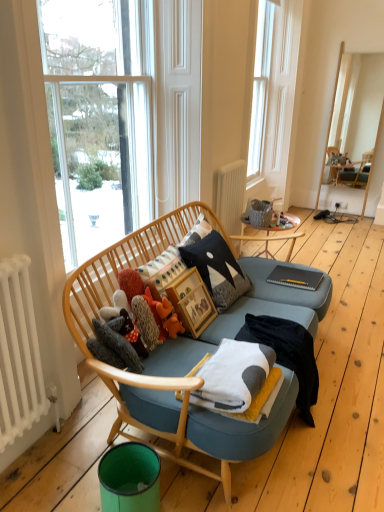
Question: Which direction should I rotate to look at white soft blanket at center, which is the first blanket from back to front?

Choices:
 (A) right
 (B) left

Answer: (A)

Question: Is fuzzy fabric stuffed animal at center, the 2th toy viewed from the right, not within white soft blanket at center, which is the second blanket from back to front?

Choices:
 (A) yes
 (B) no

Answer: (A)

Question: From a real-world perspective, is fuzzy fabric stuffed animal at center, the 2th toy viewed from the right, positioned under white soft blanket at center, which is the second blanket from back to front, based on gravity?

Choices:
 (A) no
 (B) yes

Answer: (A)

Question: Could white soft blanket at center, arranged as the 1th blanket when viewed from the front, be considered to be inside fuzzy fabric stuffed animal at center, which ranks as the first toy in left-to-right order?

Choices:
 (A) yes
 (B) no

Answer: (B)

Question: Considering the relative positions of fuzzy fabric stuffed animal at center, the 2th toy viewed from the right, and white soft blanket at center, which is the second blanket from back to front, in the image provided, is fuzzy fabric stuffed animal at center, the 2th toy viewed from the right, behind white soft blanket at center, which is the second blanket from back to front,?

Choices:
 (A) no
 (B) yes

Answer: (B)

Question: Is fuzzy fabric stuffed animal at center, the 2th toy viewed from the right, with white soft blanket at center, arranged as the 1th blanket when viewed from the front?

Choices:
 (A) yes
 (B) no

Answer: (B)

Question: Does fuzzy fabric stuffed animal at center, which ranks as the first toy in left-to-right order, appear on the right side of white soft blanket at center, which is the second blanket from back to front?

Choices:
 (A) no
 (B) yes

Answer: (A)

Question: Is transparent glass window at upper center looking in the opposite direction of green matte trash can at lower left?

Choices:
 (A) yes
 (B) no

Answer: (B)

Question: From the image's perspective, is transparent glass window at upper center above green matte trash can at lower left?

Choices:
 (A) yes
 (B) no

Answer: (A)

Question: Is transparent glass window at upper center shorter than green matte trash can at lower left?

Choices:
 (A) yes
 (B) no

Answer: (B)

Question: Is transparent glass window at upper center positioned behind green matte trash can at lower left?

Choices:
 (A) no
 (B) yes

Answer: (B)

Question: Is transparent glass window at upper center outside green matte trash can at lower left?

Choices:
 (A) no
 (B) yes

Answer: (B)

Question: Are transparent glass window at upper center and green matte trash can at lower left far apart?

Choices:
 (A) yes
 (B) no

Answer: (A)

Question: Does white radiator at lower left, which is the first radiator in bottom-to-top order, contain white soft blanket at center, arranged as the 1th blanket when viewed from the front?

Choices:
 (A) yes
 (B) no

Answer: (B)